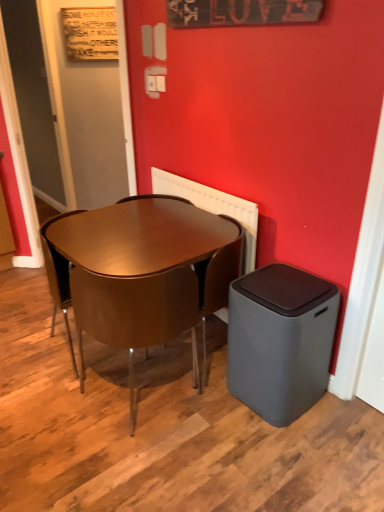
This screenshot has width=384, height=512. Identify the location of blank space to the left of brown leather chair at center, which is the 2th chair in left-to-right order. (59, 407).